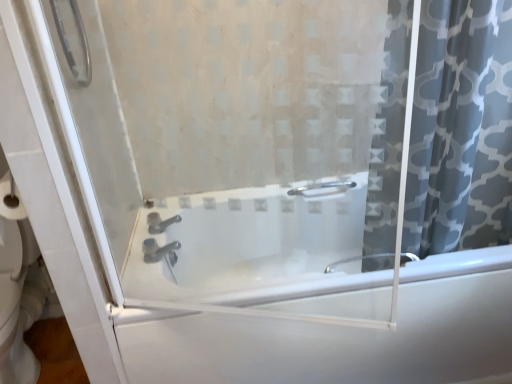
Question: Should I look upward or downward to see white glossy bathtub at center?

Choices:
 (A) down
 (B) up

Answer: (A)

Question: Is gray patterned fabric at right facing away from white glossy bathtub at center?

Choices:
 (A) yes
 (B) no

Answer: (B)

Question: Does gray patterned fabric at right have a lesser height compared to white glossy bathtub at center?

Choices:
 (A) no
 (B) yes

Answer: (A)

Question: Is gray patterned fabric at right closer to camera compared to white glossy bathtub at center?

Choices:
 (A) no
 (B) yes

Answer: (B)

Question: Is gray patterned fabric at right to the left of white glossy bathtub at center from the viewer's perspective?

Choices:
 (A) yes
 (B) no

Answer: (B)

Question: Are gray patterned fabric at right and white glossy bathtub at center beside each other?

Choices:
 (A) no
 (B) yes

Answer: (A)

Question: Considering the relative sizes of gray patterned fabric at right and white glossy bathtub at center in the image provided, is gray patterned fabric at right bigger than white glossy bathtub at center?

Choices:
 (A) yes
 (B) no

Answer: (B)

Question: Can you confirm if white glossy bathtub at center is thinner than gray patterned fabric at right?

Choices:
 (A) no
 (B) yes

Answer: (A)

Question: From the image's perspective, is white glossy bathtub at center above gray patterned fabric at right?

Choices:
 (A) no
 (B) yes

Answer: (A)

Question: From a real-world perspective, is white glossy bathtub at center on top of gray patterned fabric at right?

Choices:
 (A) no
 (B) yes

Answer: (A)

Question: Is white glossy bathtub at center at the left side of gray patterned fabric at right?

Choices:
 (A) no
 (B) yes

Answer: (B)

Question: Considering the relative sizes of white glossy bathtub at center and gray patterned fabric at right in the image provided, is white glossy bathtub at center wider than gray patterned fabric at right?

Choices:
 (A) yes
 (B) no

Answer: (A)

Question: Are white glossy bathtub at center and gray patterned fabric at right beside each other?

Choices:
 (A) no
 (B) yes

Answer: (A)

Question: Is satin nickel faucet at center turned away from white glossy bathtub at center?

Choices:
 (A) no
 (B) yes

Answer: (A)